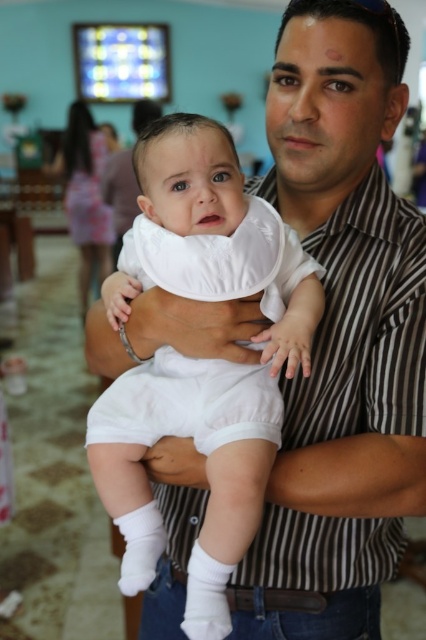
Is white soft bib at center wider than white striped shirt at center?

No.

Does white soft bib at center come in front of white striped shirt at center?

Yes, white soft bib at center is closer to the viewer.

I want to click on white soft bib at center, so click(201, 358).

Identify the location of white soft bib at center. The height and width of the screenshot is (640, 426). (201, 358).